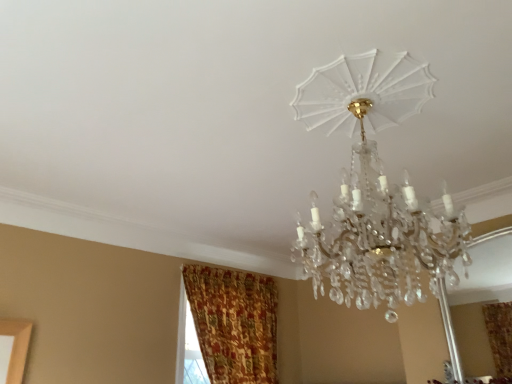
Question: Would you say textured gold curtain at lower left is inside or outside clear crystal chandelier at upper center?

Choices:
 (A) inside
 (B) outside

Answer: (B)

Question: In terms of height, does textured gold curtain at lower left look taller or shorter compared to clear crystal chandelier at upper center?

Choices:
 (A) short
 (B) tall

Answer: (B)

Question: Is textured gold curtain at lower left bigger or smaller than clear crystal chandelier at upper center?

Choices:
 (A) small
 (B) big

Answer: (A)

Question: From a real-world perspective, is clear crystal chandelier at upper center physically located above or below textured gold curtain at lower left?

Choices:
 (A) below
 (B) above

Answer: (B)

Question: Considering the positions of clear crystal chandelier at upper center and textured gold curtain at lower left in the image, is clear crystal chandelier at upper center taller or shorter than textured gold curtain at lower left?

Choices:
 (A) short
 (B) tall

Answer: (A)

Question: Looking at their shapes, would you say clear crystal chandelier at upper center is wider or thinner than textured gold curtain at lower left?

Choices:
 (A) wide
 (B) thin

Answer: (A)

Question: Based on their sizes in the image, would you say clear crystal chandelier at upper center is bigger or smaller than textured gold curtain at lower left?

Choices:
 (A) small
 (B) big

Answer: (B)